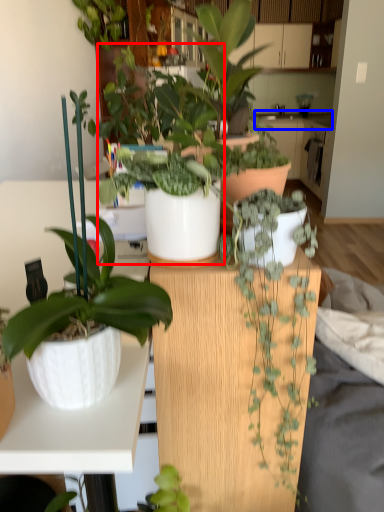
Question: Which object is closer to the camera taking this photo, houseplant (highlighted by a red box) or counter top (highlighted by a blue box)?

Choices:
 (A) houseplant
 (B) counter top

Answer: (A)